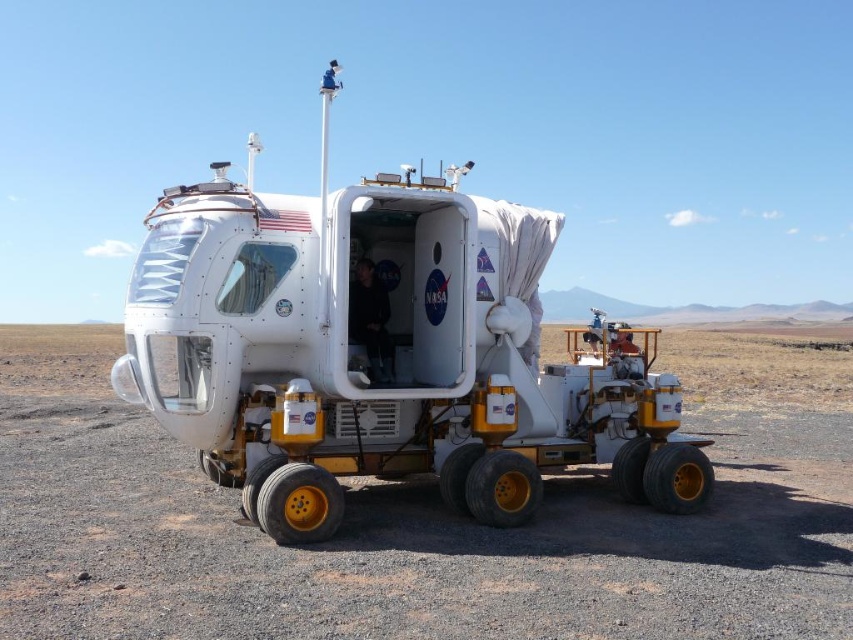
You are a NASA engineer observing the rover and the surrounding area. Given that the dirt gravel at center is smaller than the white matte rover at center, can you determine which object occupies more space in the image?

The white matte rover at center occupies more space in the image because it is larger than the dirt gravel at center.

You are an engineer observing the NASA rover in the desert. You need to determine if the dirt gravel at center can be fully covered by the white matte rover at center. Based on their heights, can the rover completely cover the dirt gravel?

The dirt gravel at center is shorter than white matte rover at center, so the rover can fully cover the dirt gravel since it is taller.

You are an astronaut on Mars and see the dirt gravel at center and the white matte rover at center. Which object is positioned to the right side of the other?

The dirt gravel at center is to the right of the white matte rover at center.